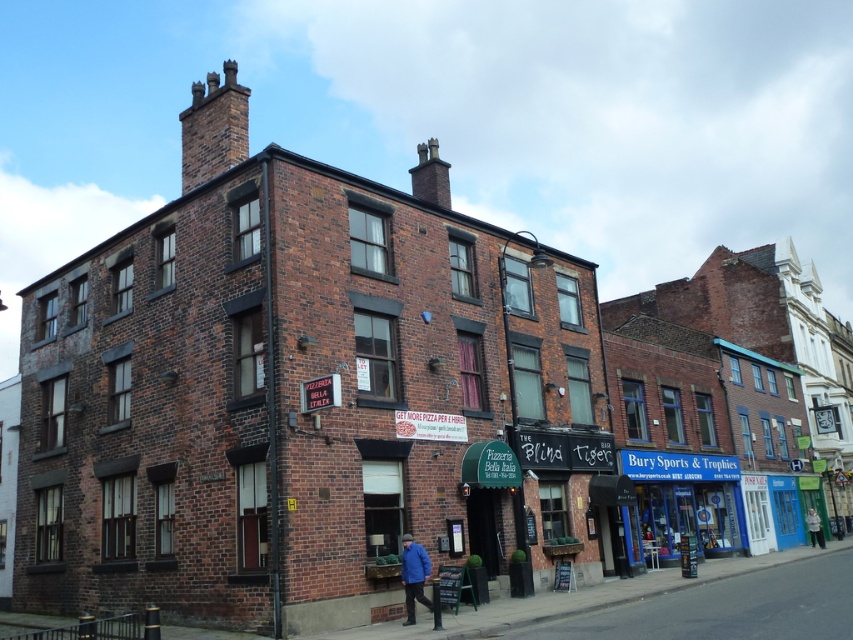
Question: Where is blue glass storefront at center located in relation to light gray fabric jacket at lower right in the image?

Choices:
 (A) above
 (B) below

Answer: (A)

Question: Estimate the real-world distances between objects in this image. Which object is closer to the light gray fabric jacket at lower right?

Choices:
 (A) blue fabric jacket at lower center
 (B) blue glass storefront at center

Answer: (B)

Question: Is blue glass storefront at center thinner than light gray fabric jacket at lower right?

Choices:
 (A) no
 (B) yes

Answer: (A)

Question: Which point is farther to the camera?

Choices:
 (A) (820, 528)
 (B) (412, 570)
 (C) (721, 534)

Answer: (A)

Question: Estimate the real-world distances between objects in this image. Which object is farther from the blue glass storefront at center?

Choices:
 (A) light gray fabric jacket at lower right
 (B) blue fabric jacket at lower center

Answer: (B)

Question: Does blue fabric jacket at lower center have a lesser width compared to light gray fabric jacket at lower right?

Choices:
 (A) no
 (B) yes

Answer: (A)